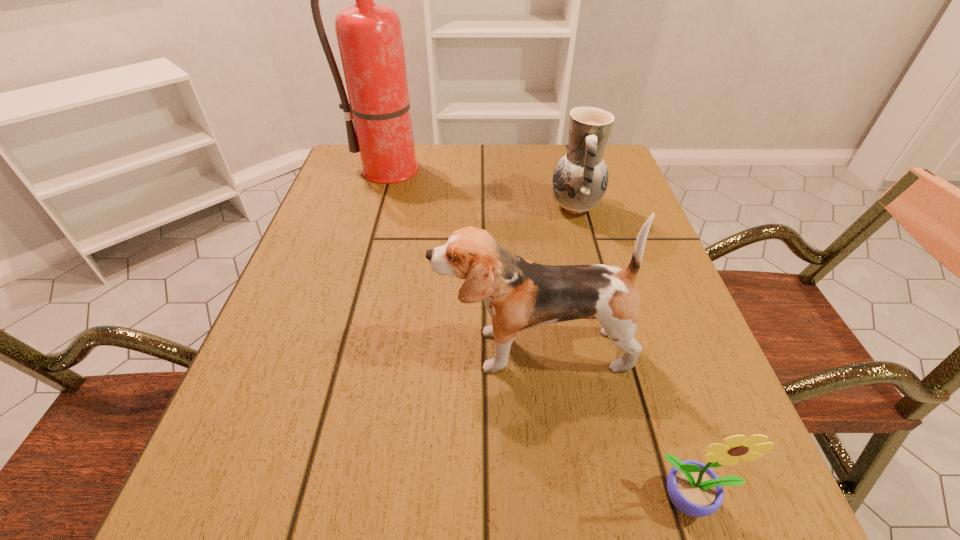
The height and width of the screenshot is (540, 960). What are the coordinates of `pottery at the right edge` in the screenshot? It's located at (580, 179).

At what (x,y) coordinates should I click in order to perform the action: click on sunflower that is at the right edge. Please return your answer as a coordinate pair (x, y). The image size is (960, 540). Looking at the image, I should click on (694, 488).

Locate an element on the screen. This screenshot has width=960, height=540. object that is positioned at the far left corner is located at coordinates (369, 35).

Find the location of a particular element. This screenshot has width=960, height=540. object that is at the far right corner is located at coordinates (580, 179).

You are a GUI agent. You are given a task and a screenshot of the screen. Output one action in this format:
    pyautogui.click(x=<x>, y=<y>)
    Task: Click on the object present at the near right corner
    The width and height of the screenshot is (960, 540).
    Given the screenshot: What is the action you would take?
    [694, 488]

You are a GUI agent. You are given a task and a screenshot of the screen. Output one action in this format:
    pyautogui.click(x=<x>, y=<y>)
    Task: Click on the vacant space at the far edge of the desktop
    The height and width of the screenshot is (540, 960).
    Given the screenshot: What is the action you would take?
    pyautogui.click(x=433, y=169)

I want to click on free region at the near edge, so click(x=587, y=488).

Where is `blank space at the left edge of the desktop`? The height and width of the screenshot is (540, 960). blank space at the left edge of the desktop is located at coordinates (315, 292).

The height and width of the screenshot is (540, 960). In the image, there is a desktop. What are the coordinates of `vacant space at the right edge` in the screenshot? It's located at (612, 254).

Where is `blank space at the near left corner of the desktop`? The image size is (960, 540). blank space at the near left corner of the desktop is located at coordinates (215, 498).